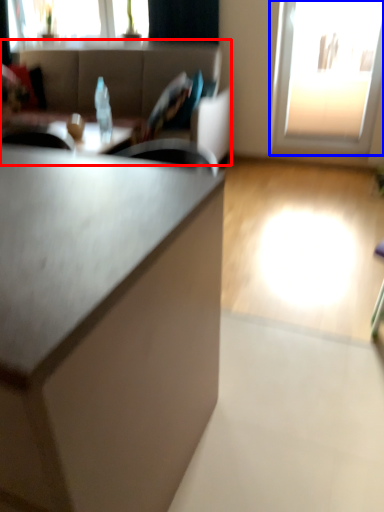
Question: Among these objects, which one is nearest to the camera, studio couch (highlighted by a red box) or window (highlighted by a blue box)?

Choices:
 (A) studio couch
 (B) window

Answer: (A)